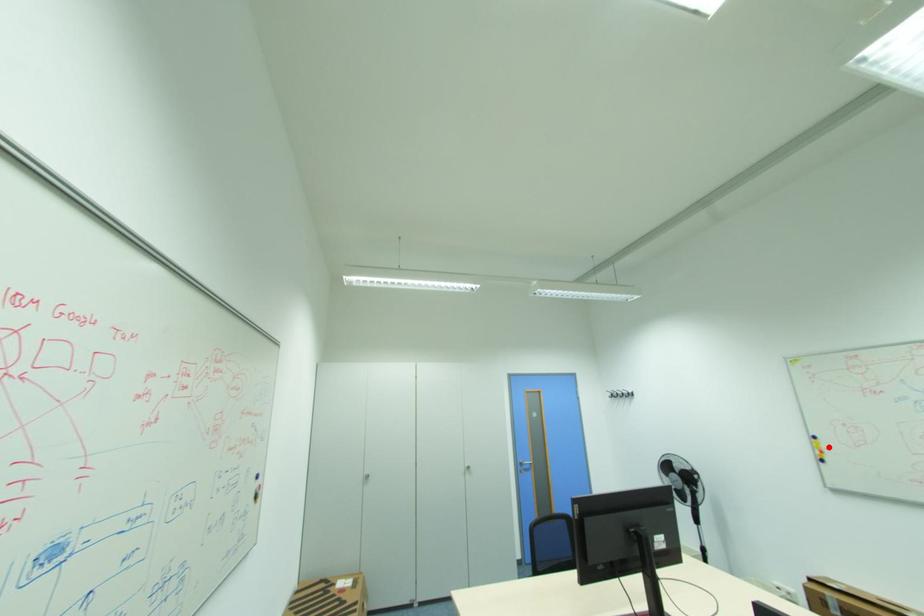
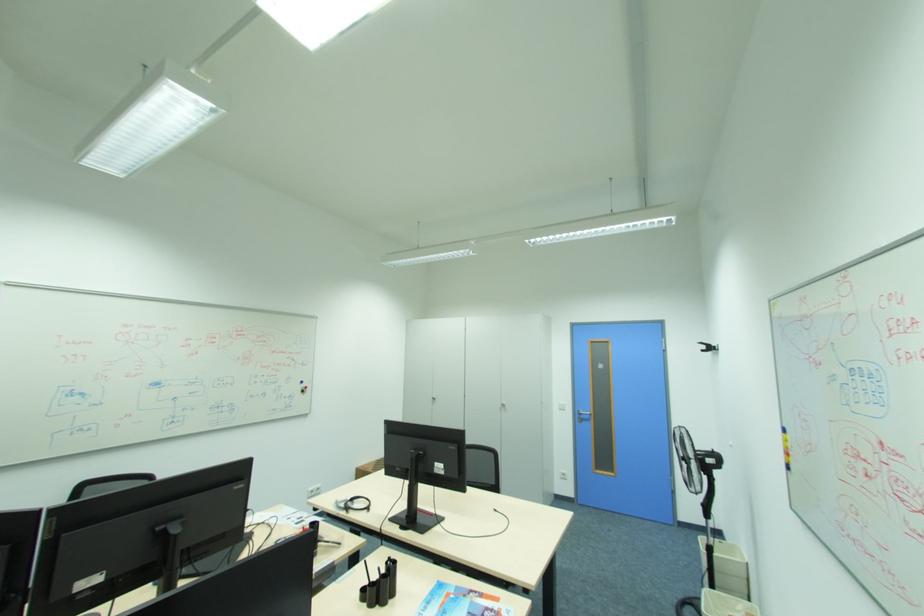
Find the pixel in the second image that matches the highlighted location in the first image.

(794, 446)